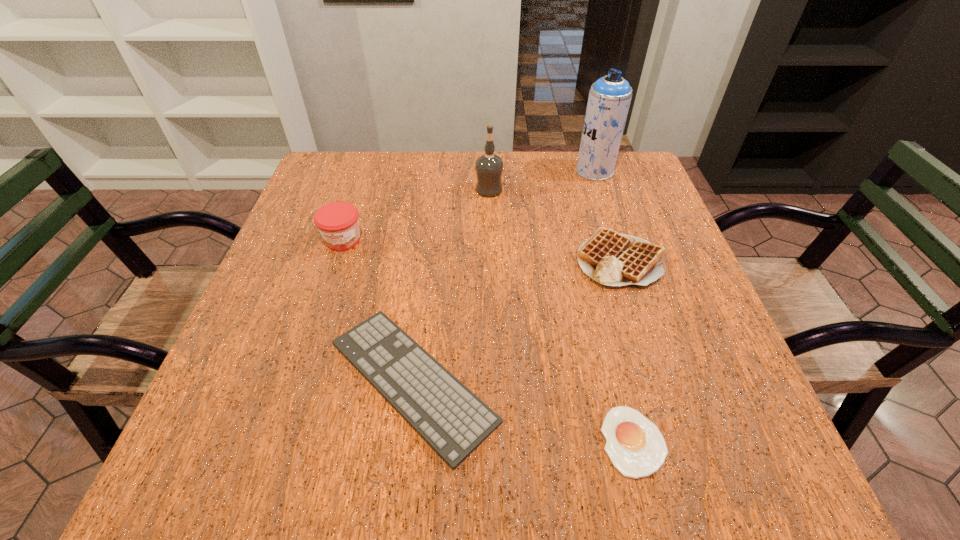
Locate an element on the screen. This screenshot has width=960, height=540. free space between the third tallest object and the aerosol can is located at coordinates (468, 206).

Find the location of a particular element. Image resolution: width=960 pixels, height=540 pixels. vacant space that is in between the computer keyboard and the waffle is located at coordinates (516, 320).

This screenshot has width=960, height=540. Find the location of `free area in between the third tallest object and the shortest object`. free area in between the third tallest object and the shortest object is located at coordinates (489, 341).

Image resolution: width=960 pixels, height=540 pixels. What are the coordinates of `free spot between the waffle and the aerosol can` in the screenshot? It's located at pos(607,214).

Identify which object is located as the fourth nearest to the jam. Please provide its 2D coordinates. Your answer should be formatted as a tuple, i.e. [(x, y)], where the tuple contains the x and y coordinates of a point satisfying the conditions above.

[(609, 99)]

The height and width of the screenshot is (540, 960). I want to click on object that is the closest to the vodka, so click(x=613, y=259).

I want to click on vacant space that satisfies the following two spatial constraints: 1. on the front label of the fifth shortest object; 2. on the left side of the shortest object, so click(x=495, y=441).

Find the location of `vacant space that satisfies the following two spatial constraints: 1. on the front label of the fifth shortest object; 2. on the label side of the jam`. vacant space that satisfies the following two spatial constraints: 1. on the front label of the fifth shortest object; 2. on the label side of the jam is located at coordinates (491, 240).

At what (x,y) coordinates should I click in order to perform the action: click on vacant space that satisfies the following two spatial constraints: 1. on the front label of the fourth tallest object; 2. on the right side of the fifth nearest object. Please return your answer as a coordinate pair (x, y). The height and width of the screenshot is (540, 960). Looking at the image, I should click on (491, 259).

The width and height of the screenshot is (960, 540). Identify the location of vacant space that satisfies the following two spatial constraints: 1. on the label side of the egg yolk; 2. on the left side of the jam. tap(277, 441).